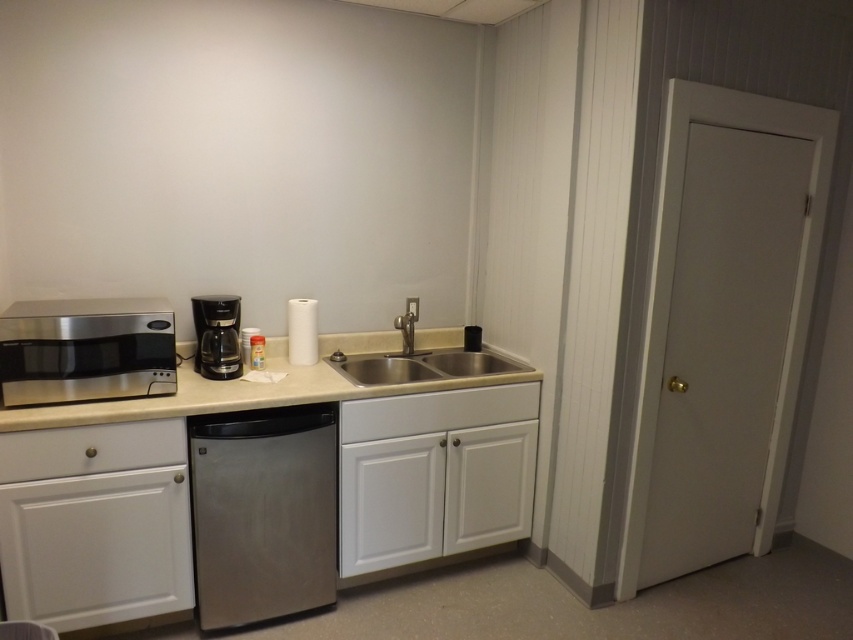
Question: Which point is farther to the camera?

Choices:
 (A) black plastic coffee machine at center
 (B) white matte cabinet at center
 (C) stainless steel microwave at left
 (D) white matte drawer at lower left

Answer: (A)

Question: Which point is farther to the camera?

Choices:
 (A) white matte drawer at lower left
 (B) white matte cabinet at center
 (C) black plastic coffee machine at center

Answer: (C)

Question: Is beige laminate counter top at center thinner than black plastic coffee machine at center?

Choices:
 (A) no
 (B) yes

Answer: (A)

Question: Among these objects, which one is nearest to the camera?

Choices:
 (A) white matte cabinet at center
 (B) black plastic coffee machine at center
 (C) stainless steel microwave at left

Answer: (C)

Question: Does white matte drawer at lower left have a greater width compared to white matte cabinet at center?

Choices:
 (A) yes
 (B) no

Answer: (B)

Question: Can you confirm if white matte cabinet at center is wider than black plastic coffee machine at center?

Choices:
 (A) no
 (B) yes

Answer: (B)